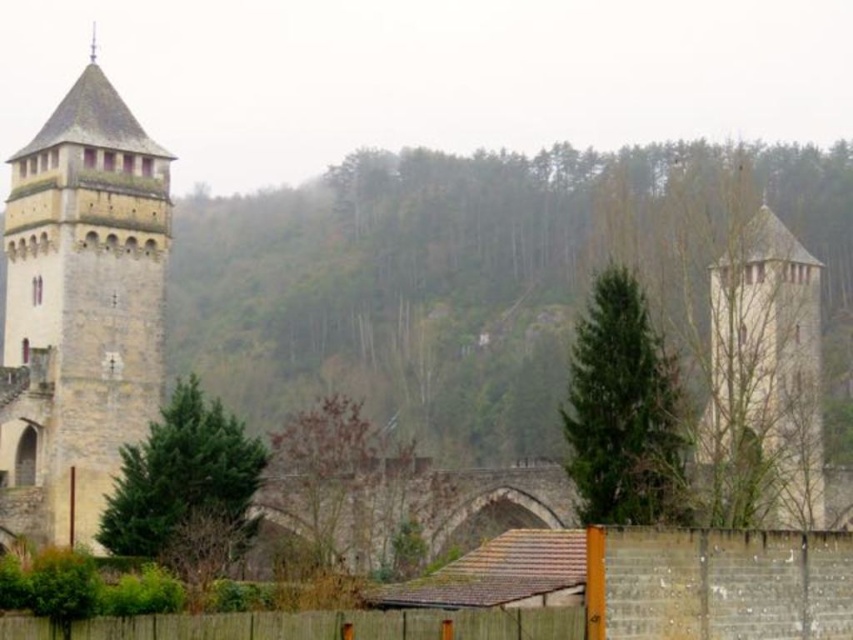
You are a visitor approaching the castle through the arched gateway. As you walk towards the stone tower at left and the brown wooden fence at lower center, which object will you encounter first?

You will encounter the brown wooden fence at lower center first because it is closer to the entrance where you are approaching from, while the stone tower at left is positioned further to the left and likely farther away.

You are a visitor approaching the castle entrance. You see the brown wooden fence at lower center and the light beige stone tower at right. Which object is closer to you as you approach the entrance?

The brown wooden fence at lower center is closer to you because it is positioned under the light beige stone tower at right, indicating it is in front of the tower from your perspective.